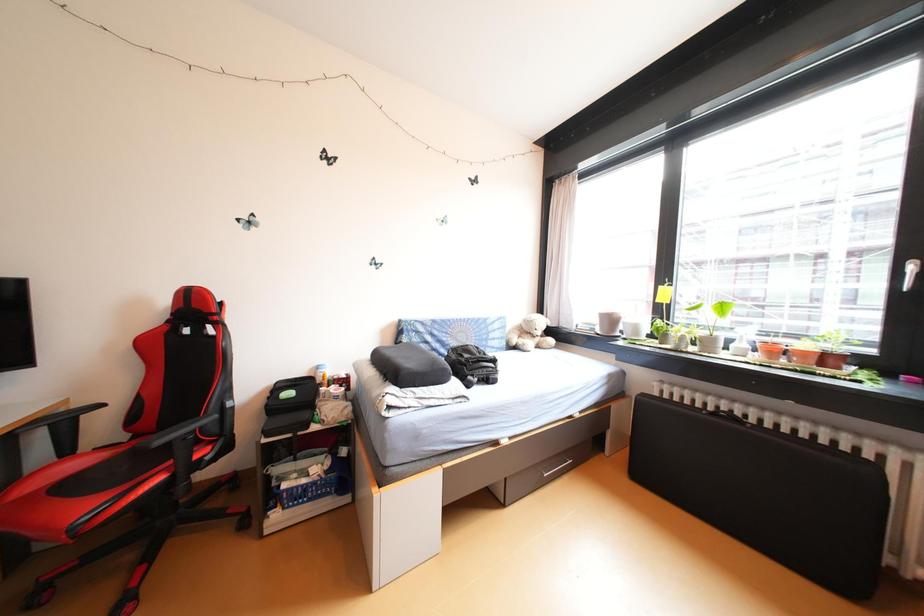
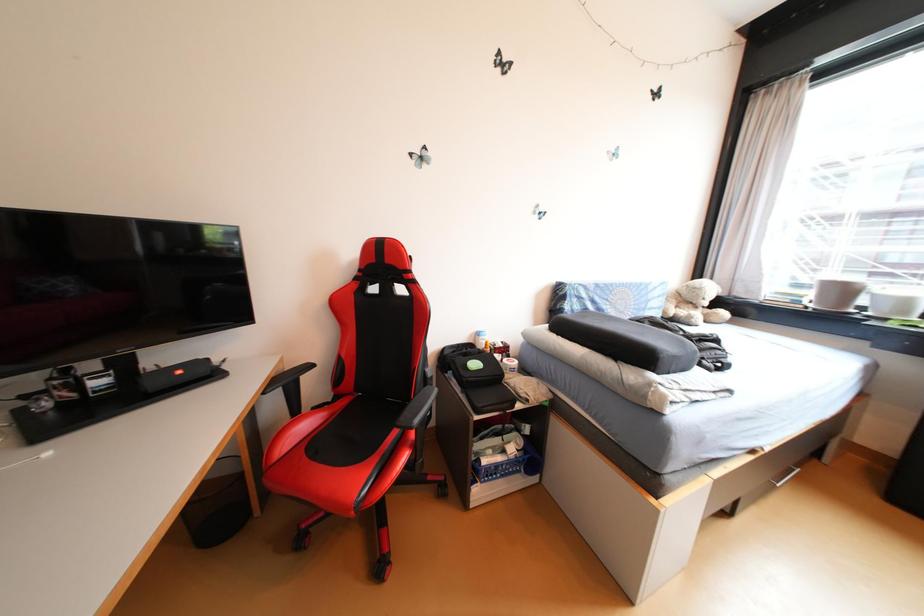
Question: Which direction would the cameraman need to move to produce the second image? Reply with the corresponding letter.

Choices:
 (A) Left
 (B) Right
 (C) Forward
 (D) Backward

Answer: (A)